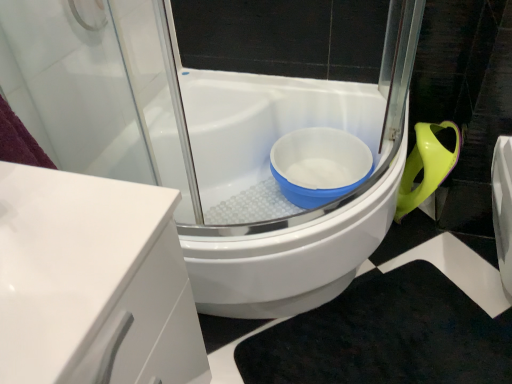
What is the approximate width of white plastic basin at center?

36.42 centimeters.

Find the location of `white plastic basin at center`. white plastic basin at center is located at coordinates click(319, 165).

Describe the element at coordinates (319, 165) in the screenshot. I see `white plastic basin at center` at that location.

This screenshot has width=512, height=384. I want to click on white plastic basin at center, so click(x=319, y=165).